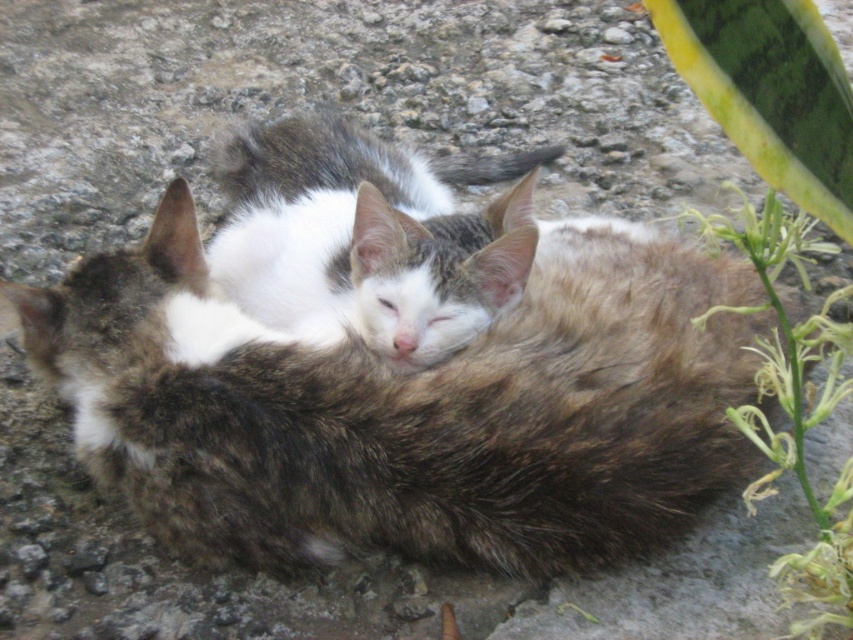
Based on the photo, does fluffy brown cat at center have a lesser width compared to green leafy plant at right?

In fact, fluffy brown cat at center might be wider than green leafy plant at right.

Does fluffy brown cat at center have a greater height compared to green leafy plant at right?

No, fluffy brown cat at center is not taller than green leafy plant at right.

Is point (318, 394) positioned behind point (833, 618)?

Yes.

Where is `fluffy brown cat at center`? fluffy brown cat at center is located at coordinates (409, 406).

Who is more forward, (392, 340) or (691, 214)?

Point (392, 340) is in front.

Locate an element on the screen. white fur cat at center is located at coordinates (369, 236).

This screenshot has height=640, width=853. What do you see at coordinates (369, 236) in the screenshot? I see `white fur cat at center` at bounding box center [369, 236].

Identify the location of white fur cat at center. 369,236.

Can you confirm if fluffy brown cat at center is positioned below white fur cat at center?

Indeed, fluffy brown cat at center is positioned under white fur cat at center.

Does point (247, 378) lie in front of point (250, 305)?

That is True.

At what (x,y) coordinates should I click in order to perform the action: click on fluffy brown cat at center. Please return your answer as a coordinate pair (x, y). The height and width of the screenshot is (640, 853). Looking at the image, I should click on (409, 406).

At what (x,y) coordinates should I click in order to perform the action: click on fluffy brown cat at center. Please return your answer as a coordinate pair (x, y). The height and width of the screenshot is (640, 853). Looking at the image, I should click on (409, 406).